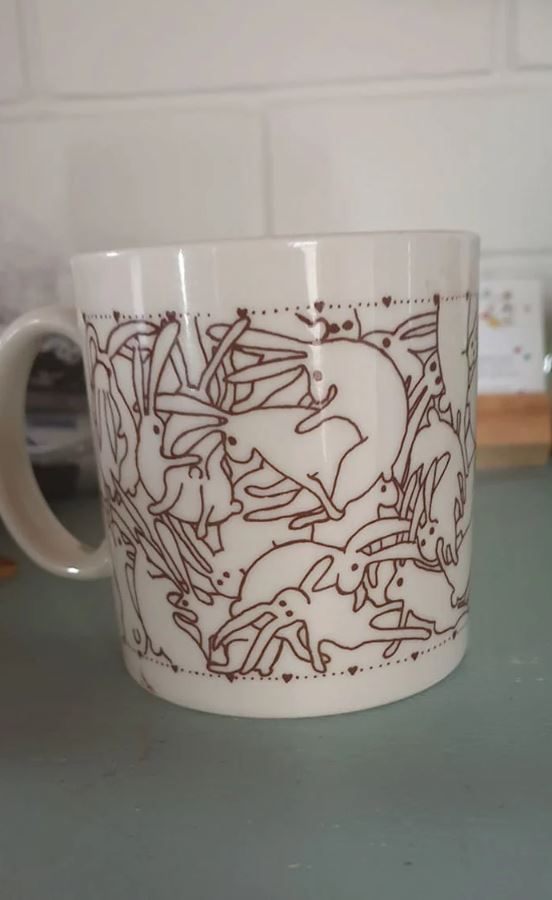
The image size is (552, 900). In order to click on mug in this screenshot , I will do `click(253, 279)`.